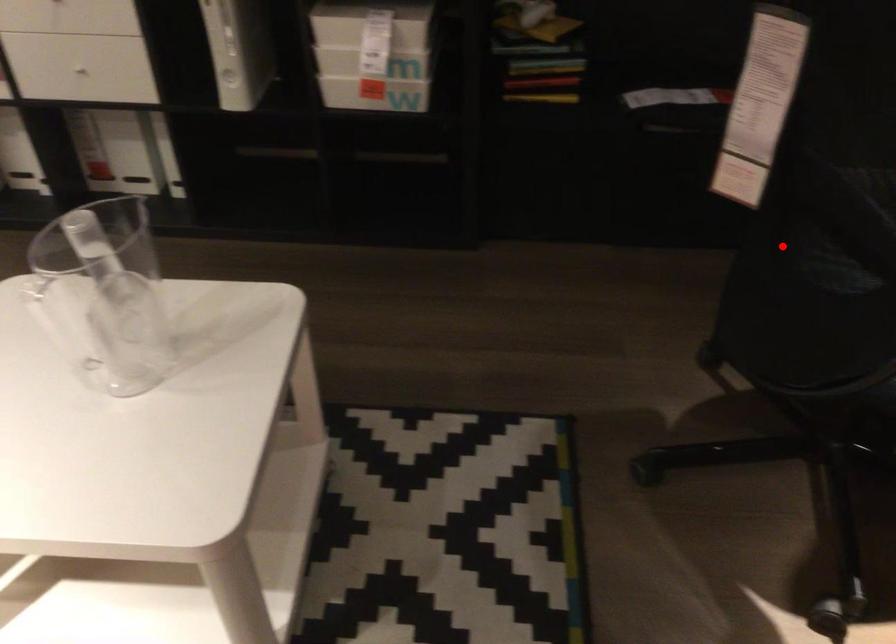
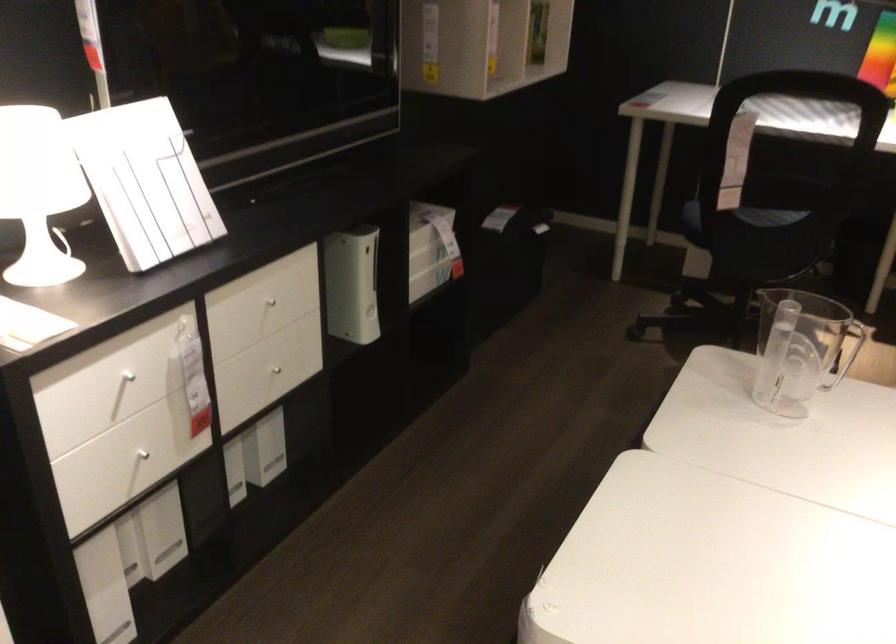
Where in the second image is the point corresponding to the highlighted location from the first image?

(739, 218)